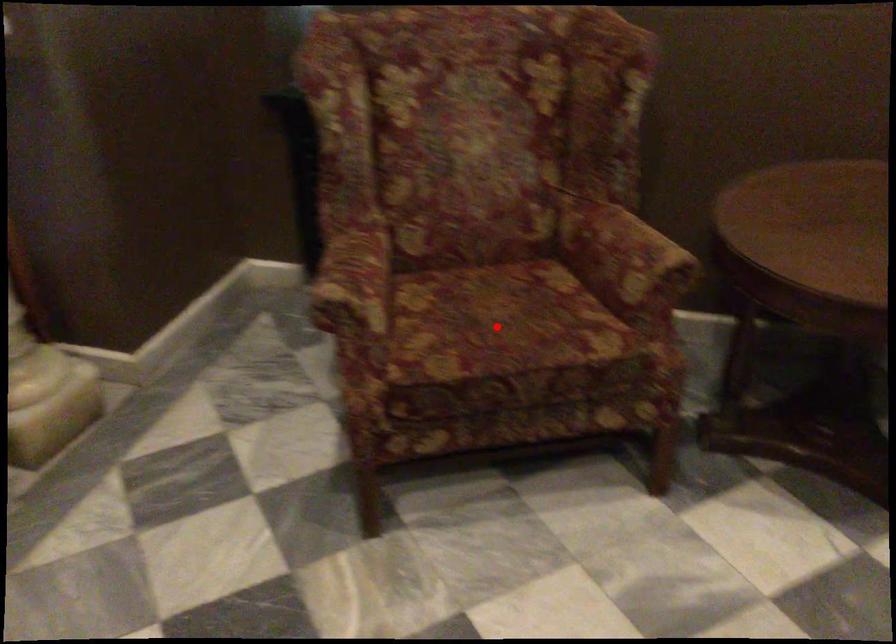
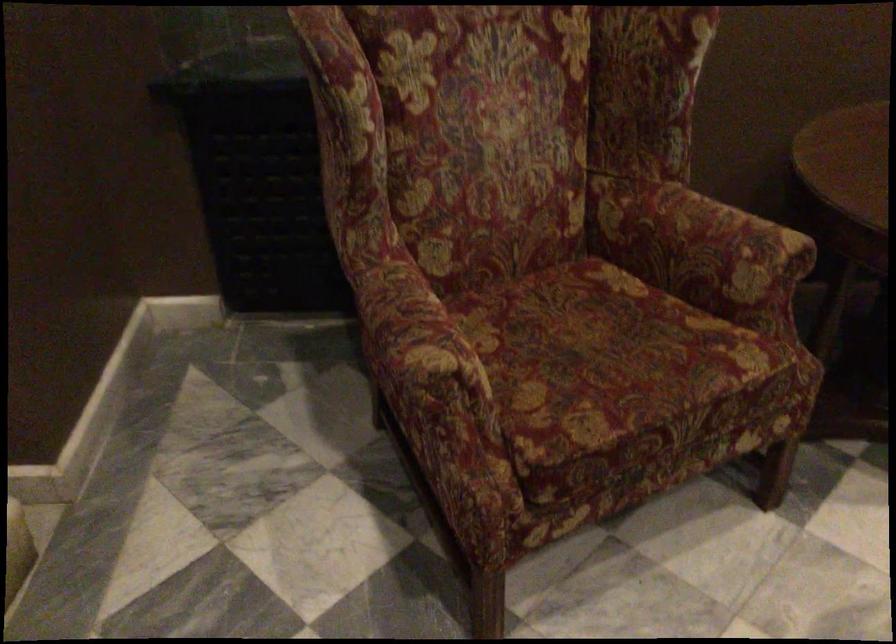
Question: I am providing you with two images of the same scene from different viewpoints. In image1, a red point is highlighted. Considering the same 3D point in image2, which of the following is correct?

Choices:
 (A) It is closer
 (B) It is farther

Answer: (A)